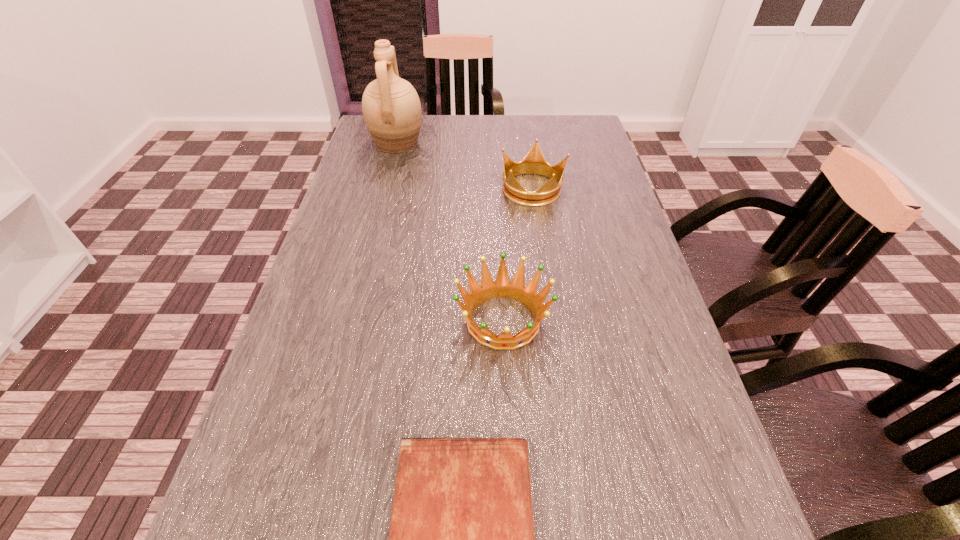
Where is `free spot that satisfies the following two spatial constraints: 1. on the front side of the farthest object; 2. on the left side of the third nearest object`? This screenshot has width=960, height=540. free spot that satisfies the following two spatial constraints: 1. on the front side of the farthest object; 2. on the left side of the third nearest object is located at coordinates (386, 188).